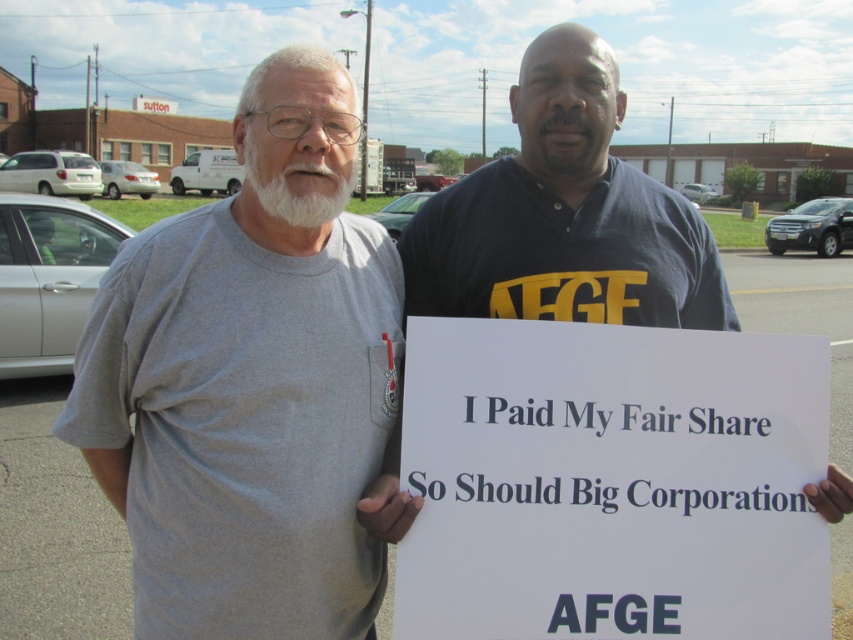
Is gray cotton t-shirt at center to the left of white paper sign at center from the viewer's perspective?

Yes, gray cotton t-shirt at center is to the left of white paper sign at center.

Describe the element at coordinates (253, 385) in the screenshot. This screenshot has width=853, height=640. I see `gray cotton t-shirt at center` at that location.

Identify the location of gray cotton t-shirt at center. This screenshot has height=640, width=853. (253, 385).